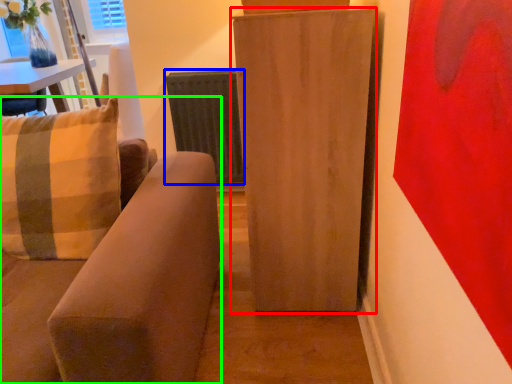
Question: Considering the real-world distances, which object is closest to furniture (highlighted by a red box)? radiator (highlighted by a blue box) or studio couch (highlighted by a green box).

Choices:
 (A) radiator
 (B) studio couch

Answer: (B)